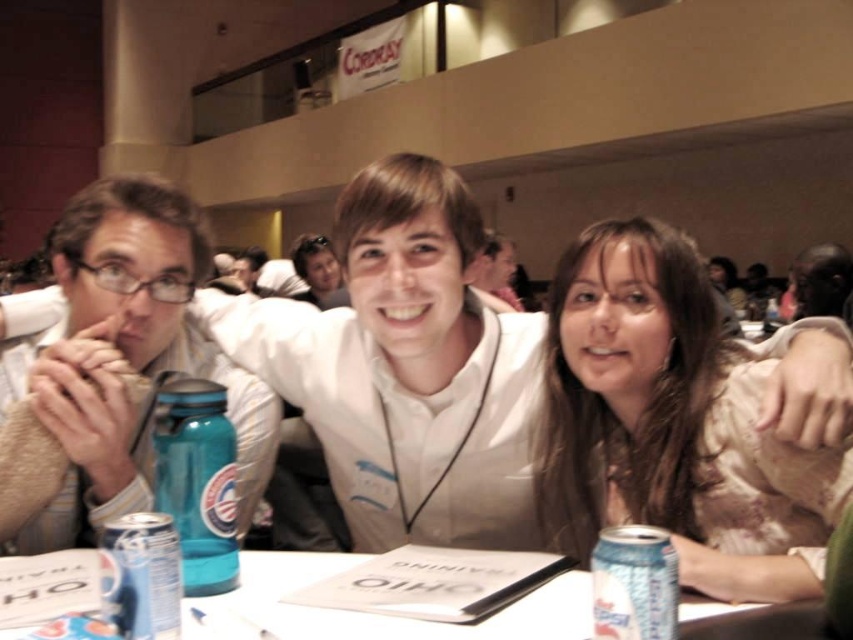
You are a photographer adjusting the camera settings to capture a clear shot of both the teal plastic water bottle at center and the silver metallic can at lower left. Given their distance apart, will you need to adjust the focus to ensure both are in sharp focus simultaneously?

The teal plastic water bottle at center and silver metallic can at lower left are 5.89 inches apart from each other. To capture both in sharp focus, the photographer should ensure the camera has a depth of field sufficient to cover this distance. If the aperture is set to a smaller opening, like f8 or higher, the depth of field will be deeper, allowing both objects to remain in focus without needing to adjust the focus point.

You are a photographer at a conference event. You need to position a teal plastic water bottle at center and a smooth beige blouse at center in a way that the water bottle is not overlapping with the blouse. Based on the scene description, which object should be placed to the left to avoid overlap?

The teal plastic water bottle at center should be placed to the left of the smooth beige blouse at center to avoid overlapping since the smooth beige blouse at center is to the right of the teal plastic water bottle at center.

What are the exact coordinates of the teal plastic water bottle at center?

The teal plastic water bottle at center is located at point (x=196, y=481).